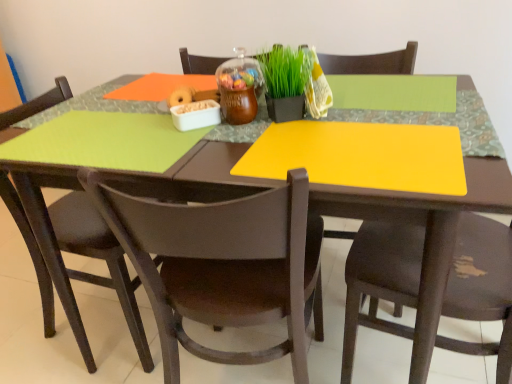
Question: In which direction should I rotate to look at brown plastic chair at center, placed as the 2th chair when sorted from right to left?

Choices:
 (A) right
 (B) left

Answer: (B)

Question: Is matte brown chair at lower right, the 3th chair in the left-to-right sequence, far away from green matte plant at center?

Choices:
 (A) no
 (B) yes

Answer: (A)

Question: Is matte brown chair at lower right, placed as the 1th chair when sorted from right to left, bigger than green matte plant at center?

Choices:
 (A) no
 (B) yes

Answer: (B)

Question: Is the position of matte brown chair at lower right, the 3th chair in the left-to-right sequence, more distant than that of green matte plant at center?

Choices:
 (A) no
 (B) yes

Answer: (A)

Question: Is matte brown chair at lower right, the 3th chair in the left-to-right sequence, outside of green matte plant at center?

Choices:
 (A) no
 (B) yes

Answer: (B)

Question: Is matte brown chair at lower right, placed as the 1th chair when sorted from right to left, to the right of green matte plant at center from the viewer's perspective?

Choices:
 (A) yes
 (B) no

Answer: (A)

Question: Considering the relative sizes of matte brown chair at lower right, the 3th chair in the left-to-right sequence, and green matte plant at center in the image provided, is matte brown chair at lower right, the 3th chair in the left-to-right sequence, taller than green matte plant at center?

Choices:
 (A) no
 (B) yes

Answer: (B)

Question: Is matte brown chair at lower left, which is the 3th chair from right to left, wider than green matte plant at center?

Choices:
 (A) no
 (B) yes

Answer: (B)

Question: Does matte brown chair at lower left, placed as the 1th chair when sorted from left to right, contain green matte plant at center?

Choices:
 (A) yes
 (B) no

Answer: (B)

Question: Is matte brown chair at lower left, placed as the 1th chair when sorted from left to right, to the right of green matte plant at center from the viewer's perspective?

Choices:
 (A) yes
 (B) no

Answer: (B)

Question: From the image's perspective, would you say matte brown chair at lower left, placed as the 1th chair when sorted from left to right, is shown under green matte plant at center?

Choices:
 (A) yes
 (B) no

Answer: (A)

Question: Is matte brown chair at lower left, which is the 3th chair from right to left, positioned behind green matte plant at center?

Choices:
 (A) no
 (B) yes

Answer: (B)

Question: From a real-world perspective, is matte brown chair at lower left, placed as the 1th chair when sorted from left to right, beneath green matte plant at center?

Choices:
 (A) no
 (B) yes

Answer: (B)

Question: Is brown plastic chair at center, the 2th chair viewed from the left, next to matte brown chair at lower right, placed as the 1th chair when sorted from right to left, and touching it?

Choices:
 (A) no
 (B) yes

Answer: (A)